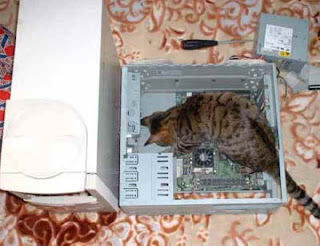
Identify the location of wires. (278, 73), (261, 57).